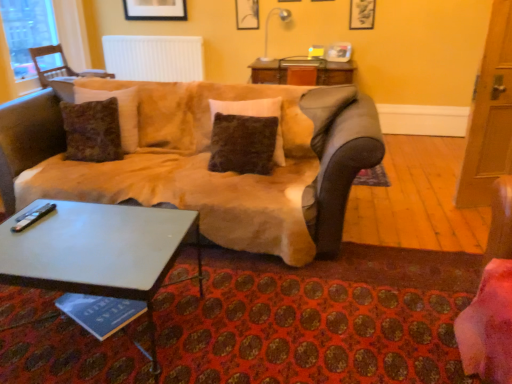
Question: Could you tell me if matte black picture frame at upper center, the 1th picture frame when ordered from back to front, is turned towards wooden chair at left?

Choices:
 (A) yes
 (B) no

Answer: (B)

Question: From the image's perspective, is matte black picture frame at upper center, the 1th picture frame when ordered from back to front, located beneath wooden chair at left?

Choices:
 (A) no
 (B) yes

Answer: (A)

Question: Is matte black picture frame at upper center, which ranks as the 2th picture frame in front-to-back order, further to camera compared to wooden chair at left?

Choices:
 (A) no
 (B) yes

Answer: (B)

Question: From the image's perspective, is matte black picture frame at upper center, which ranks as the 2th picture frame in front-to-back order, over wooden chair at left?

Choices:
 (A) yes
 (B) no

Answer: (A)

Question: Considering the relative sizes of matte black picture frame at upper center, which is the second picture frame from right to left, and wooden chair at left in the image provided, is matte black picture frame at upper center, which is the second picture frame from right to left, thinner than wooden chair at left?

Choices:
 (A) yes
 (B) no

Answer: (A)

Question: Relative to white glossy lamp at upper center, is transparent glass window at upper left in front or behind?

Choices:
 (A) behind
 (B) front

Answer: (B)

Question: Considering the positions of transparent glass window at upper left and white glossy lamp at upper center in the image, is transparent glass window at upper left taller or shorter than white glossy lamp at upper center?

Choices:
 (A) tall
 (B) short

Answer: (A)

Question: Choose the correct answer: Is transparent glass window at upper left inside white glossy lamp at upper center or outside it?

Choices:
 (A) outside
 (B) inside

Answer: (A)

Question: From the image's perspective, is transparent glass window at upper left positioned above or below white glossy lamp at upper center?

Choices:
 (A) below
 (B) above

Answer: (A)

Question: From the image's perspective, is white glossy coffee table at lower left located above or below white glossy lamp at upper center?

Choices:
 (A) above
 (B) below

Answer: (B)

Question: Is white glossy coffee table at lower left wider or thinner than white glossy lamp at upper center?

Choices:
 (A) thin
 (B) wide

Answer: (B)

Question: Is white glossy coffee table at lower left spatially inside white glossy lamp at upper center, or outside of it?

Choices:
 (A) outside
 (B) inside

Answer: (A)

Question: From their relative heights in the image, would you say white glossy coffee table at lower left is taller or shorter than white glossy lamp at upper center?

Choices:
 (A) tall
 (B) short

Answer: (B)

Question: Is white ribbed radiator at upper center taller or shorter than matte black picture frame at upper center, which is the second picture frame from right to left?

Choices:
 (A) short
 (B) tall

Answer: (B)

Question: From the image's perspective, is white ribbed radiator at upper center positioned above or below matte black picture frame at upper center, which ranks as the 2th picture frame in front-to-back order?

Choices:
 (A) below
 (B) above

Answer: (A)